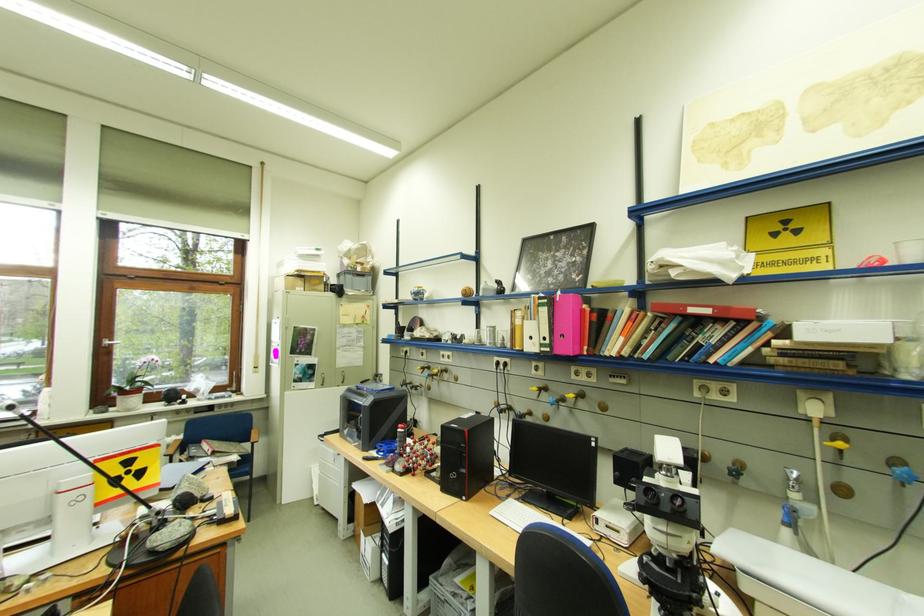
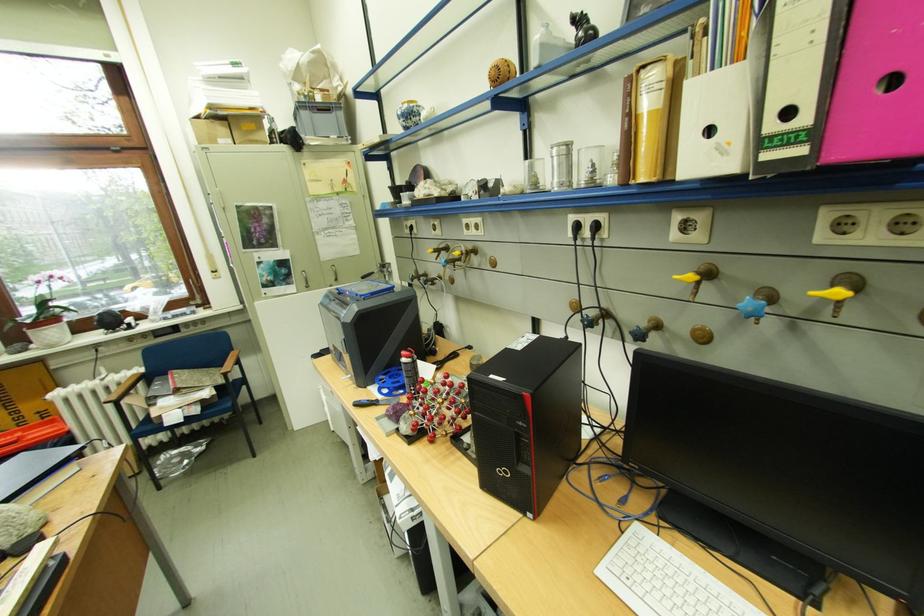
Locate, in the second image, the point that corresponds to point (225, 454) in the first image.

(187, 392)